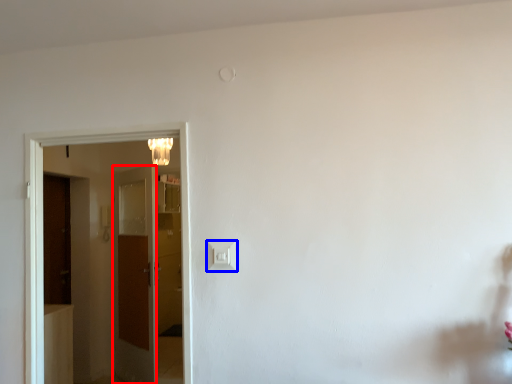
Question: Which of the following is the closest to the observer, door (highlighted by a red box) or light switch (highlighted by a blue box)?

Choices:
 (A) door
 (B) light switch

Answer: (B)